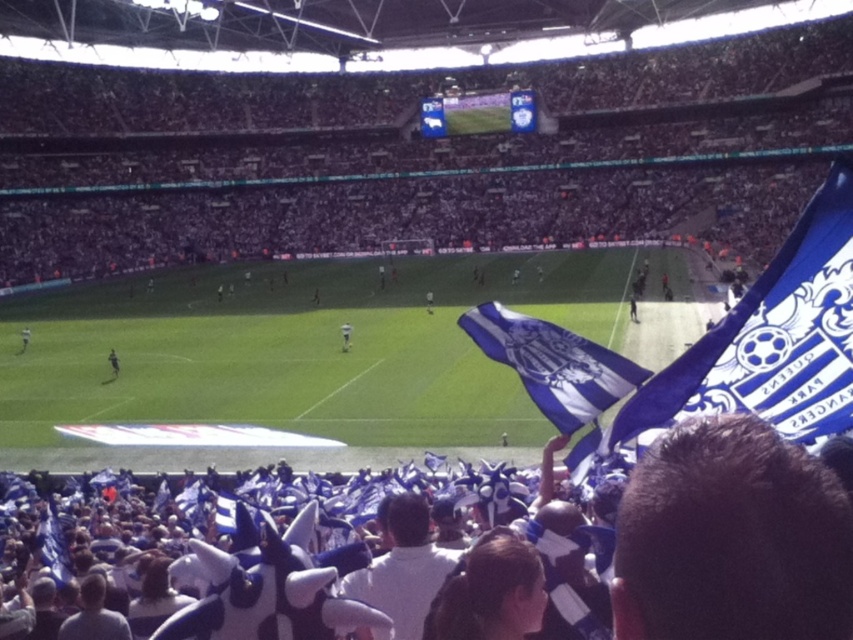
Question: Does white fabric hat at center appear under dark brown hair at lower right?

Choices:
 (A) no
 (B) yes

Answer: (B)

Question: Which object is positioned closest to the dark blue jersey at lower left?

Choices:
 (A) green grass football field at center
 (B) white fabric hat at center

Answer: (A)

Question: Considering the real-world distances, which object is closest to the blue fabric flag at right?

Choices:
 (A) blue fabric flag at center
 (B) green grass football field at center
 (C) white fabric at center
 (D) dark blue jersey at center

Answer: (A)

Question: Which point appears closest to the camera in this image?

Choices:
 (A) (706, 625)
 (B) (573, 413)
 (C) (347, 332)
 (D) (717, 148)

Answer: (A)

Question: Is white fabric at center closer to the viewer compared to dark blue jersey at center?

Choices:
 (A) yes
 (B) no

Answer: (B)

Question: Is green grass football field at center wider than blue fabric flag at center?

Choices:
 (A) no
 (B) yes

Answer: (B)